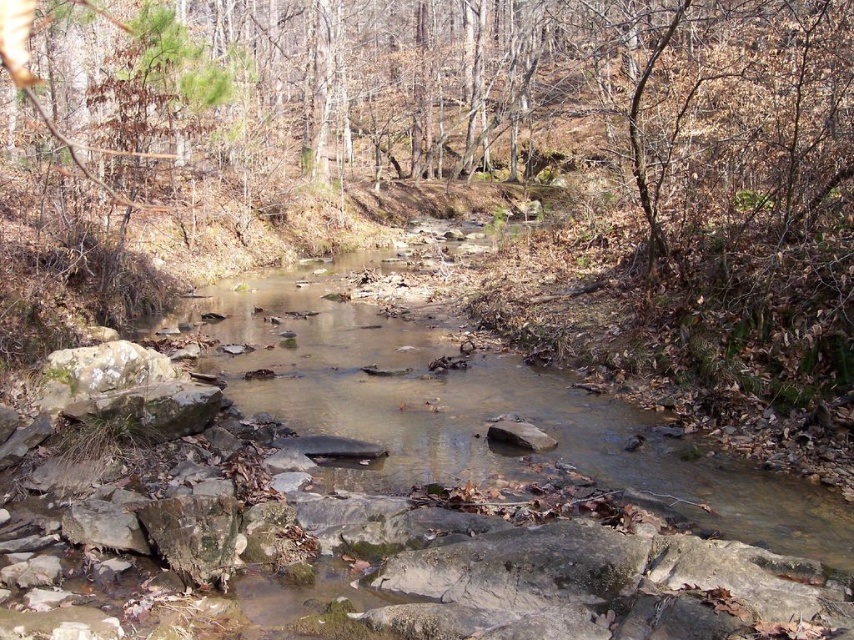
Question: Among these points, which one is nearest to the camera?

Choices:
 (A) (351, 346)
 (B) (519, 420)

Answer: (B)

Question: Which point is closer to the camera?

Choices:
 (A) smooth gray rock at center
 (B) clear water stream at center

Answer: (B)

Question: Can you confirm if clear water stream at center is thinner than smooth gray rock at center?

Choices:
 (A) no
 (B) yes

Answer: (A)

Question: Is the position of clear water stream at center more distant than that of smooth gray rock at center?

Choices:
 (A) no
 (B) yes

Answer: (A)

Question: Does clear water stream at center lie in front of smooth gray rock at center?

Choices:
 (A) no
 (B) yes

Answer: (B)